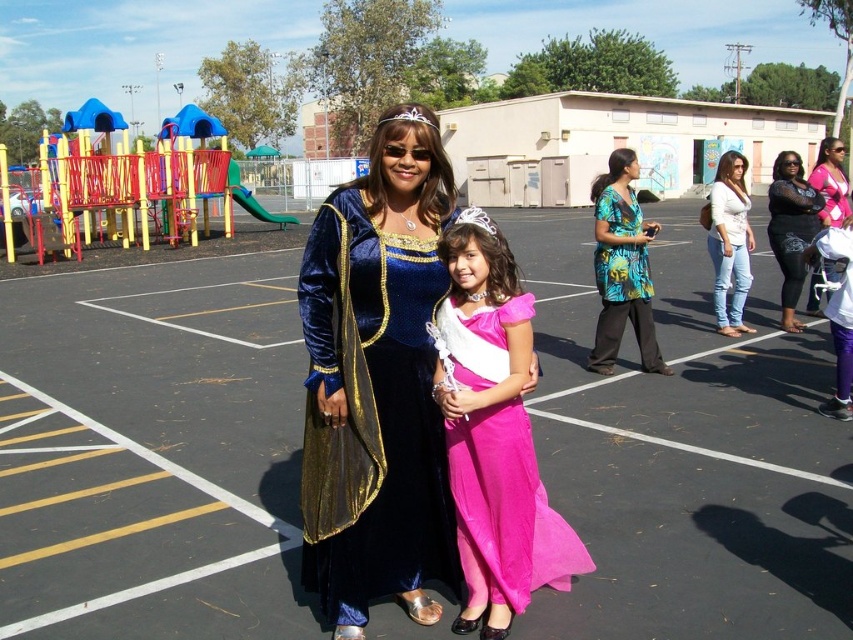
Which of these two, floral print dress at center or white denim jeans at right, stands shorter?

floral print dress at center is shorter.

Between floral print dress at center and white denim jeans at right, which one is positioned lower?

floral print dress at center

Describe the element at coordinates (622, 266) in the screenshot. The height and width of the screenshot is (640, 853). I see `floral print dress at center` at that location.

Find the location of a particular element. floral print dress at center is located at coordinates (622, 266).

Who is taller, black asphalt at center or matte black dress at right?

With more height is black asphalt at center.

Which is more to the left, black asphalt at center or matte black dress at right?

black asphalt at center

Find the location of a particular element. This screenshot has height=640, width=853. black asphalt at center is located at coordinates (155, 451).

Is black asphalt at center smaller than velvet blue dress at center?

Actually, black asphalt at center might be larger than velvet blue dress at center.

Does black asphalt at center lie behind velvet blue dress at center?

Yes, black asphalt at center is further from the viewer.

Does point (572, 326) come behind point (404, 349)?

Yes, it is.

Find the location of `black asphalt at center`. black asphalt at center is located at coordinates (155, 451).